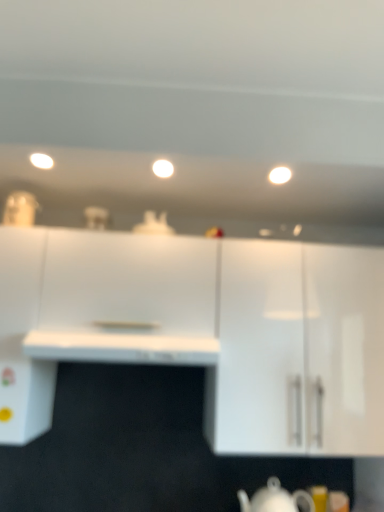
Question: Considering the positions of white glossy teapot at lower center and white glossy cabinet at upper right, marked as the 1th cabinetry in a right-to-left arrangement, in the image, is white glossy teapot at lower center taller or shorter than white glossy cabinet at upper right, marked as the 1th cabinetry in a right-to-left arrangement,?

Choices:
 (A) short
 (B) tall

Answer: (A)

Question: Is point (288, 504) positioned closer to the camera than point (294, 256)?

Choices:
 (A) closer
 (B) farther

Answer: (A)

Question: Which object is the farthest from the white glossy light at upper center, which is counted as the 3th lighting, starting from the left?

Choices:
 (A) white glossy light fixture at center, the 2th lighting from the left
 (B) white glossy light fixture at upper left, the 3th lighting when ordered from right to left
 (C) white glossy cabinet at upper right, marked as the 1th cabinetry in a right-to-left arrangement
 (D) white glossy counter top at center
 (E) white glossy teapot at lower center

Answer: (E)

Question: Estimate the real-world distances between objects in this image. Which object is closer to the white glossy teapot at lower center?

Choices:
 (A) white glossy counter top at center
 (B) white glossy light fixture at upper left, the 3th lighting when ordered from right to left
 (C) white glossy light fixture at center, the 2th lighting from the left
 (D) white glossy light at upper center, marked as the first lighting in a right-to-left arrangement
 (E) white glossy cabinet at upper right, the second cabinetry viewed from the left

Answer: (E)